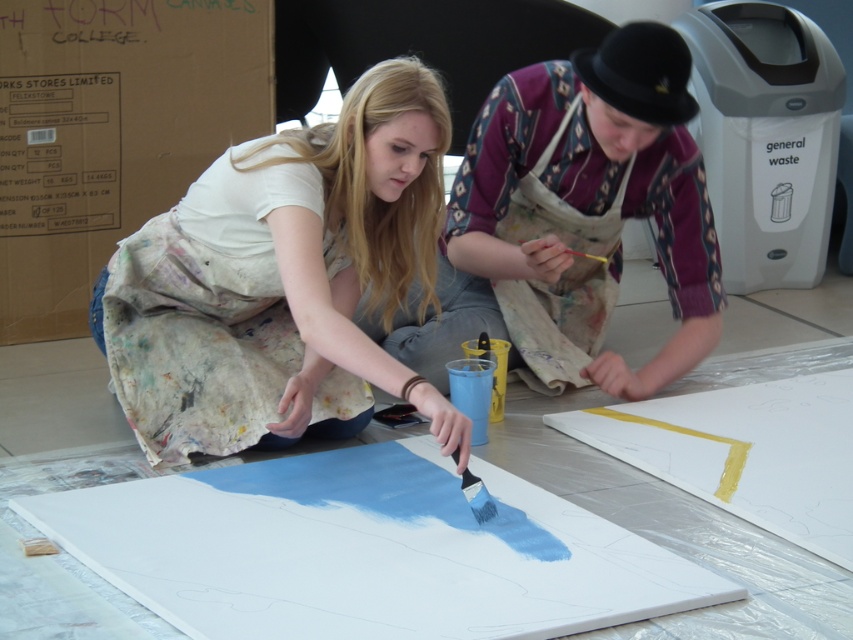
Question: Is matte white shirt at center further to camera compared to red wooden paint brush at center?

Choices:
 (A) no
 (B) yes

Answer: (A)

Question: Is matte white shirt at center bigger than red wooden paint brush at center?

Choices:
 (A) yes
 (B) no

Answer: (A)

Question: Can you confirm if matte white shirt at center is positioned to the right of red wooden paint brush at center?

Choices:
 (A) yes
 (B) no

Answer: (B)

Question: Which of the following is the closest to the observer?

Choices:
 (A) red wooden paint brush at center
 (B) matte white shirt at center

Answer: (B)